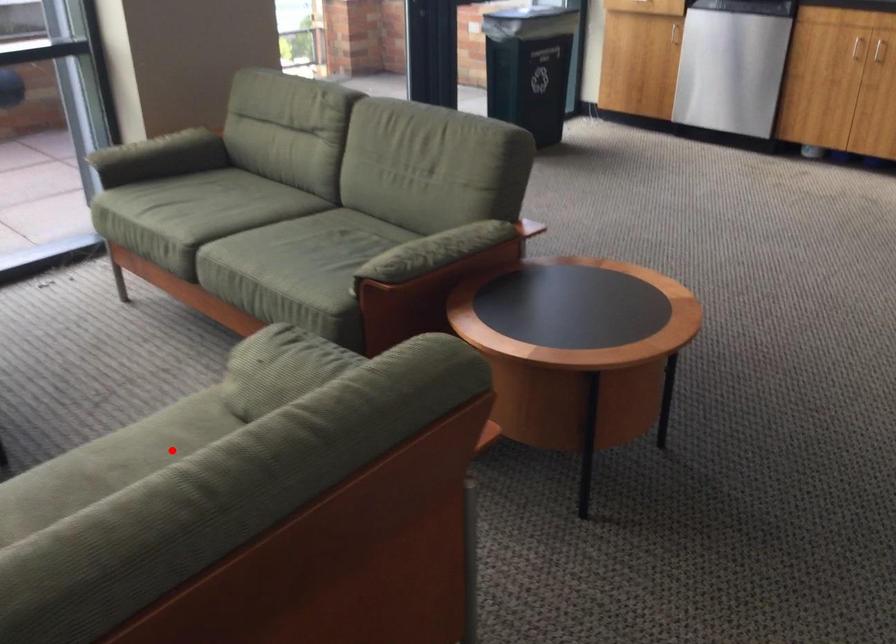
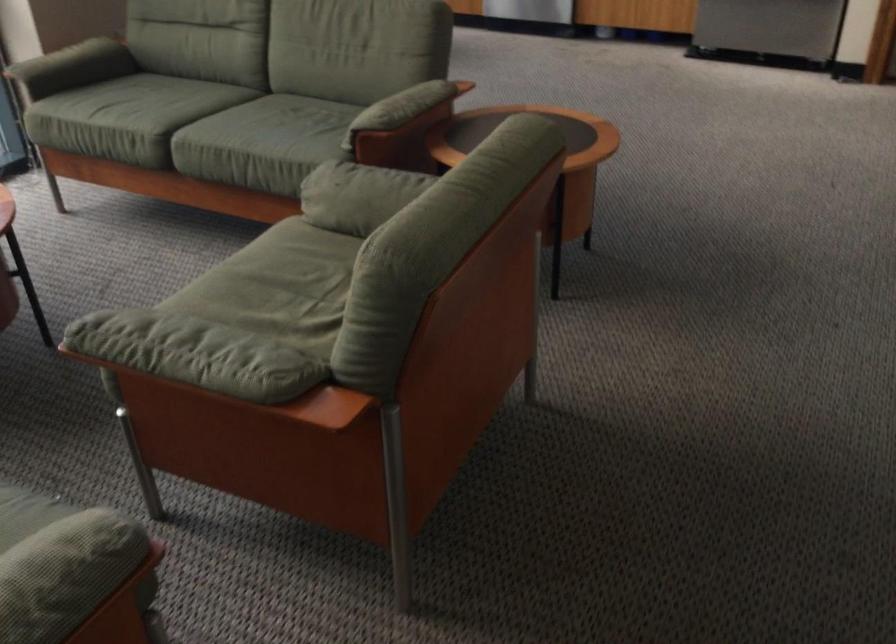
Locate, in the second image, the point that corresponds to the highlighted location in the first image.

(289, 260)